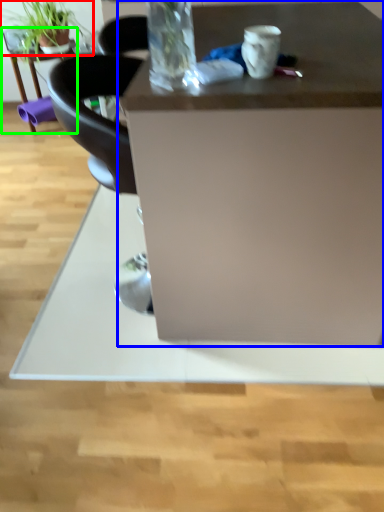
Question: Estimate the real-world distances between objects in this image. Which object is farther from houseplant (highlighted by a red box), desk (highlighted by a blue box) or table (highlighted by a green box)?

Choices:
 (A) desk
 (B) table

Answer: (A)